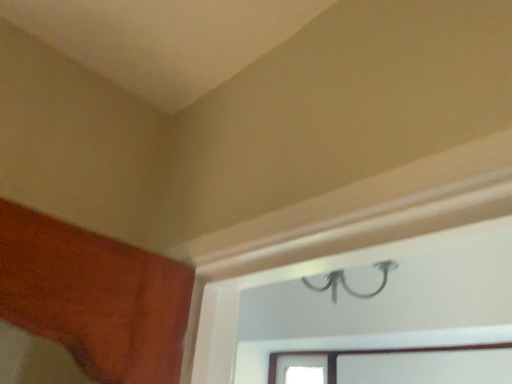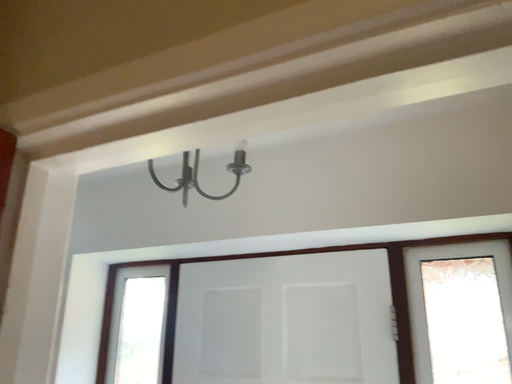
Question: Which way did the camera rotate in the video?

Choices:
 (A) rotated left
 (B) rotated right

Answer: (B)